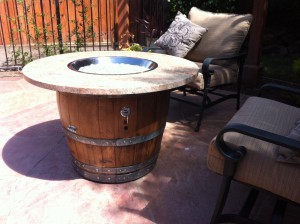
The image size is (300, 224). I want to click on right armrest, so click(279, 87), click(151, 47).